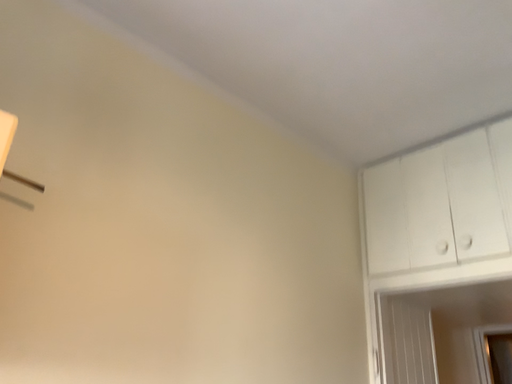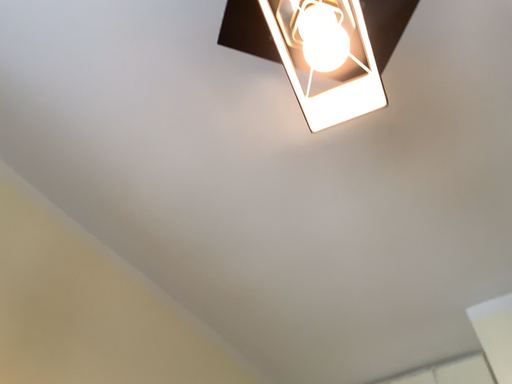
Question: How did the camera likely rotate when shooting the video?

Choices:
 (A) rotated right
 (B) rotated left

Answer: (A)